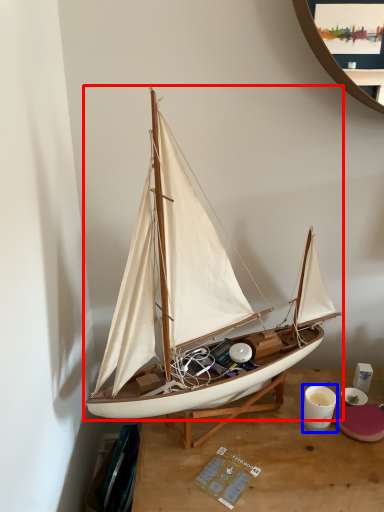
Question: Which object appears farthest to the camera in this image, boat (highlighted by a red box) or coffee cup (highlighted by a blue box)?

Choices:
 (A) boat
 (B) coffee cup

Answer: (B)